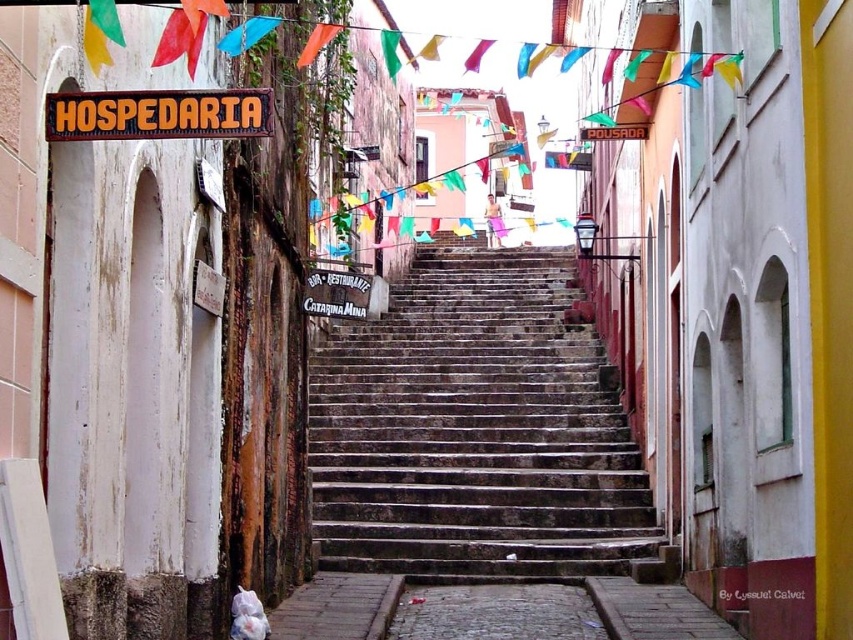
Between stone steps at center and matte red sign at center, which one is positioned lower?

stone steps at center is lower down.

In the scene shown: Is stone steps at center behind matte red sign at center?

No, it is in front of matte red sign at center.

The image size is (853, 640). What are the coordinates of `stone steps at center` in the screenshot? It's located at (474, 429).

Who is more distant from viewer, (163,125) or (308,60)?

Point (308,60)

Can you confirm if orange wood sign at upper center is positioned above orange fabric flag at upper center?

No.

Who is more distant from viewer, (61, 120) or (308, 61)?

Positioned behind is point (308, 61).

The width and height of the screenshot is (853, 640). Find the location of `orange wood sign at upper center`. orange wood sign at upper center is located at coordinates (158, 115).

Can you confirm if matte red sign at center is positioned to the right of orange fabric flag at upper center?

Yes, matte red sign at center is to the right of orange fabric flag at upper center.

Does matte red sign at center appear on the left side of orange fabric flag at upper center?

Incorrect, matte red sign at center is not on the left side of orange fabric flag at upper center.

Between point (593, 140) and point (312, 32), which one is positioned in front?

Point (312, 32) is more forward.

Locate an element on the screen. matte red sign at center is located at coordinates (614, 132).